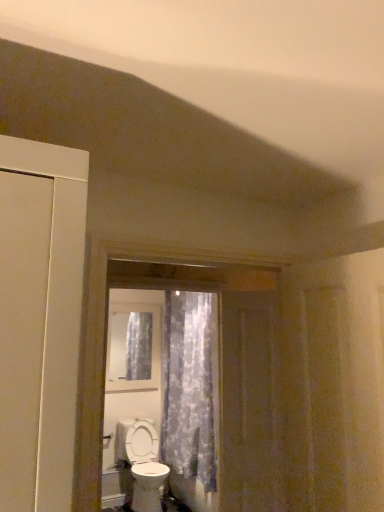
Question: Relative to brown wooden screen door at center, is white glossy toilet at lower center in front or behind?

Choices:
 (A) front
 (B) behind

Answer: (B)

Question: Is white glossy toilet at lower center inside the boundaries of brown wooden screen door at center, or outside?

Choices:
 (A) outside
 (B) inside

Answer: (A)

Question: Which of these objects is positioned farthest from the brown wooden screen door at center?

Choices:
 (A) white glossy toilet at lower center
 (B) clear glass window at center
 (C) translucent floral fabric at center

Answer: (B)

Question: Based on their relative distances, which object is nearer to the translucent floral fabric at center?

Choices:
 (A) brown wooden screen door at center
 (B) clear glass window at center
 (C) white glossy toilet at lower center

Answer: (B)